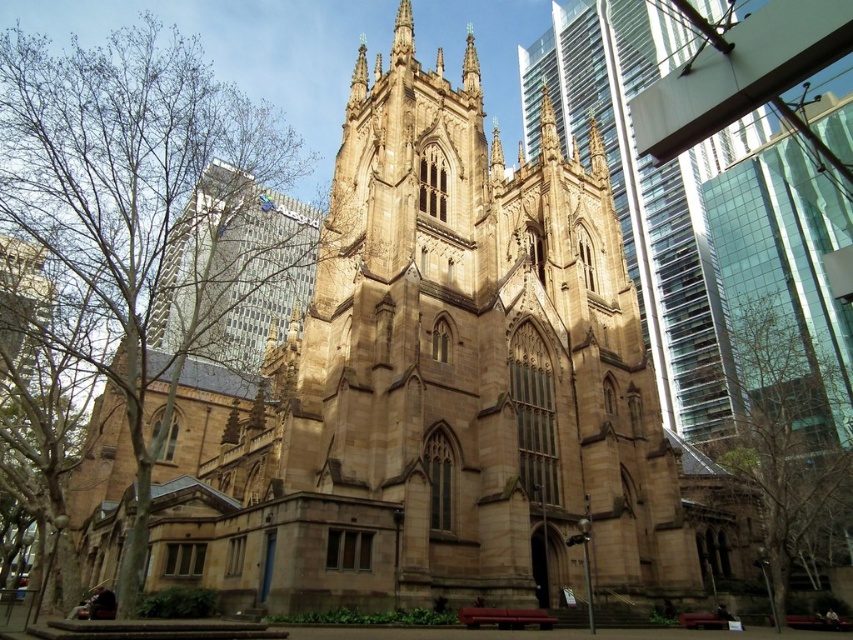
The width and height of the screenshot is (853, 640). What are the coordinates of `brown leafless tree at left` in the screenshot? It's located at (142, 205).

How much distance is there between brown leafless tree at left and brown textured tree at lower right?

115.02 meters

What do you see at coordinates (142, 205) in the screenshot? This screenshot has width=853, height=640. I see `brown leafless tree at left` at bounding box center [142, 205].

Locate an element on the screen. brown leafless tree at left is located at coordinates (142, 205).